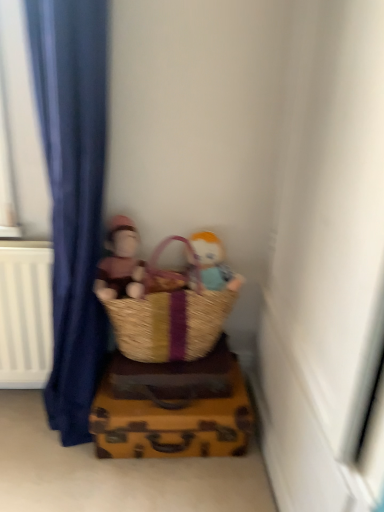
Question: Is brown woven basket at lower center to the left or to the right of brown woven picnic basket at lower center in the image?

Choices:
 (A) right
 (B) left

Answer: (B)

Question: In terms of width, does brown woven basket at lower center look wider or thinner when compared to brown woven picnic basket at lower center?

Choices:
 (A) wide
 (B) thin

Answer: (A)

Question: Estimate the real-world distances between objects in this image. Which object is closer to the brown woven basket at lower center?

Choices:
 (A) soft plush toy at center, arranged as the first person when viewed from the left
 (B) matte plastic doll at center, arranged as the second person when viewed from the left
 (C) brown woven picnic basket at lower center

Answer: (C)

Question: Which is nearer to the soft plush toy at center, the 2th person from the right?

Choices:
 (A) brown woven picnic basket at lower center
 (B) brown woven basket at lower center
 (C) matte plastic doll at center, arranged as the second person when viewed from the left

Answer: (A)